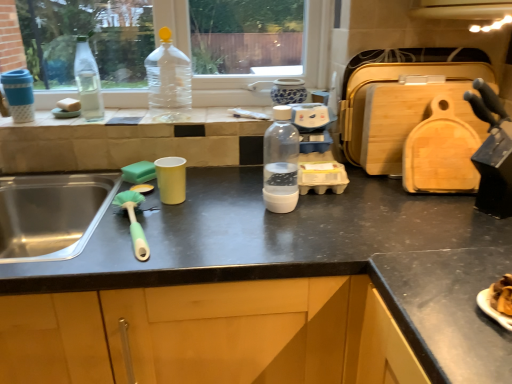
I want to click on free space on the front side of green sponge at left, marked as the first food in a front-to-back arrangement, so click(x=148, y=202).